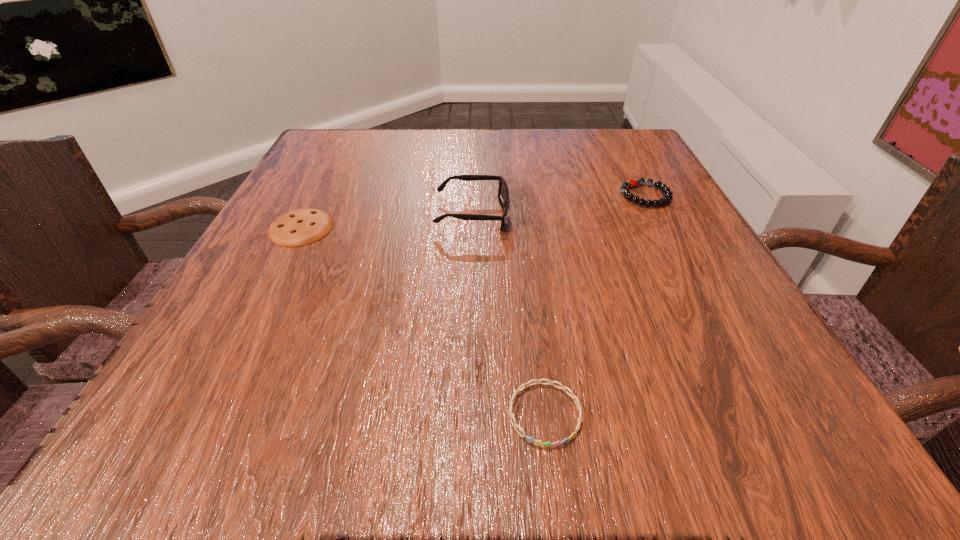
Where is `the tallest object`? The image size is (960, 540). the tallest object is located at coordinates (503, 193).

The width and height of the screenshot is (960, 540). I want to click on the taller bracelet, so click(667, 198).

Where is `the right bracelet`? the right bracelet is located at coordinates (667, 198).

Locate an element on the screen. The height and width of the screenshot is (540, 960). the leftmost object is located at coordinates (299, 227).

At what (x,y) coordinates should I click in order to perform the action: click on the left bracelet. Please return your answer as a coordinate pair (x, y). The height and width of the screenshot is (540, 960). Looking at the image, I should click on (515, 425).

Identify the location of the nearest object. tap(515, 425).

Find the location of a particular element. This screenshot has width=960, height=540. vacant space located on the front-facing side of the sunglasses is located at coordinates (563, 215).

At what (x,y) coordinates should I click in order to perform the action: click on free location located on the front of the farther bracelet. Please return your answer as a coordinate pair (x, y). Looking at the image, I should click on (695, 293).

In order to click on free space located 0.310m on the back of the cookie in this screenshot , I will do `click(347, 139)`.

This screenshot has width=960, height=540. Identify the location of object that is at the near edge. click(515, 425).